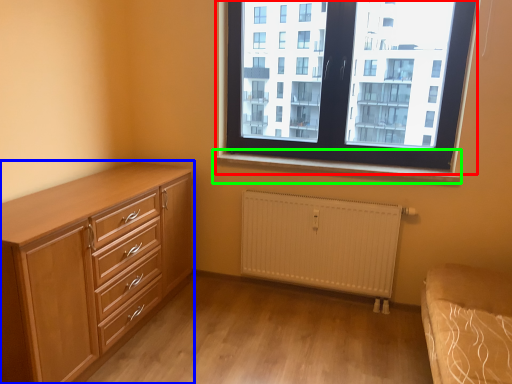
Question: Which object is the farthest from window (highlighted by a red box)? Choose among these: chest of drawers (highlighted by a blue box) or window sill (highlighted by a green box).

Choices:
 (A) chest of drawers
 (B) window sill

Answer: (A)